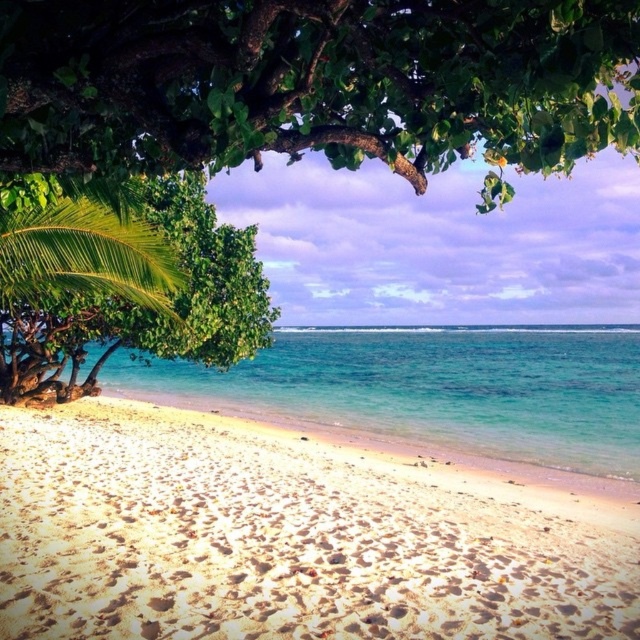
Question: Can you confirm if clear blue water at center is bigger than green leafy palm tree at upper left?

Choices:
 (A) no
 (B) yes

Answer: (B)

Question: Estimate the real-world distances between objects in this image. Which object is closer to the clear blue water at center?

Choices:
 (A) green leafy palm tree at upper left
 (B) green leafy tree at upper center
 (C) white sandy beach at lower center

Answer: (C)

Question: Can you confirm if white sandy beach at lower center is wider than green leafy palm tree at upper left?

Choices:
 (A) yes
 (B) no

Answer: (A)

Question: Among these points, which one is farthest from the camera?

Choices:
 (A) (403, 22)
 (B) (141, 218)

Answer: (B)

Question: Which is farther from the green leafy palm tree at upper left?

Choices:
 (A) white sandy beach at lower center
 (B) green leafy tree at upper center

Answer: (B)

Question: Can you confirm if clear blue water at center is positioned above green leafy palm tree at upper left?

Choices:
 (A) no
 (B) yes

Answer: (A)